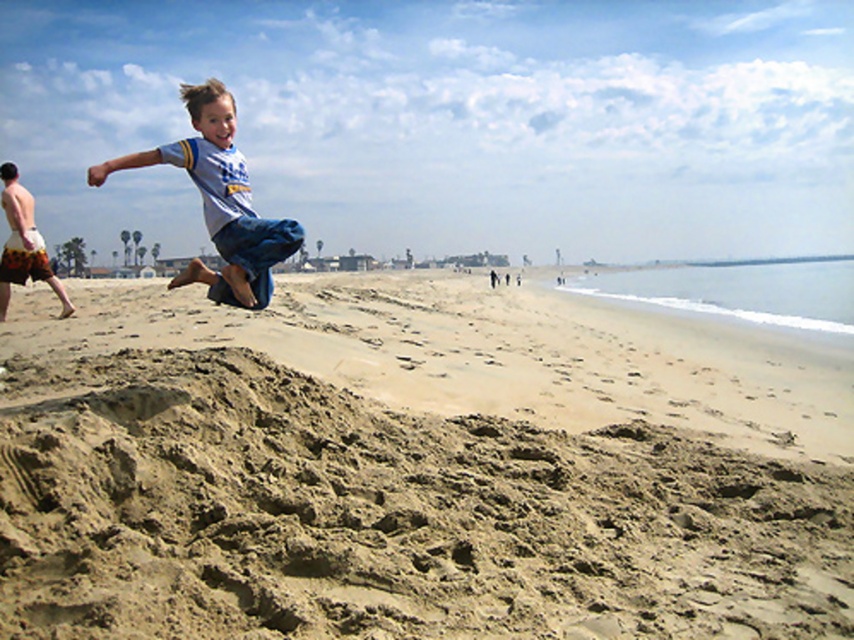
Is fine sand at center below light blue denim shorts at center?

Correct, fine sand at center is located below light blue denim shorts at center.

Is point (741, 572) farther from camera compared to point (241, 189)?

No, it is in front of (241, 189).

Is point (840, 529) farther from viewer compared to point (196, 176)?

No, it is not.

Locate an element on the screen. This screenshot has height=640, width=854. fine sand at center is located at coordinates (418, 467).